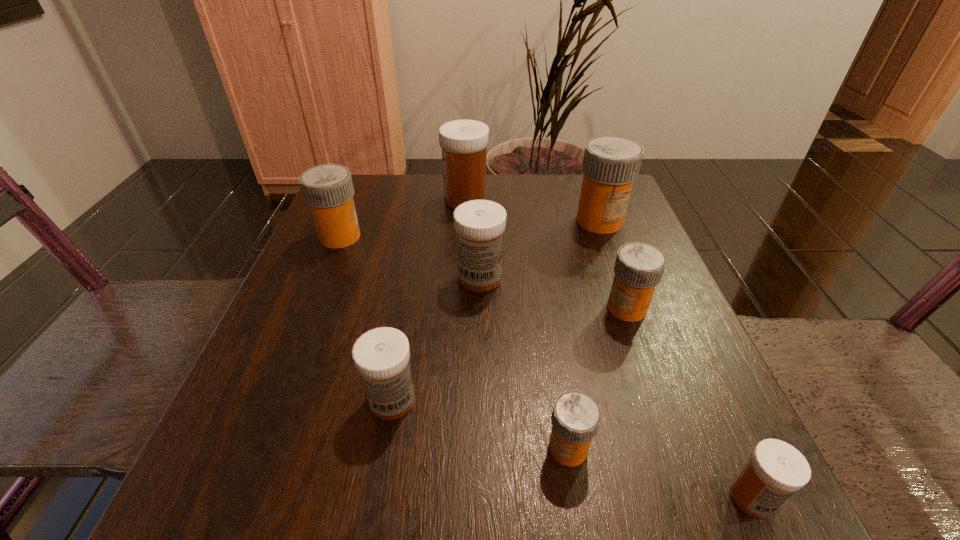
The height and width of the screenshot is (540, 960). What are the coordinates of `the nearest object` in the screenshot? It's located at (775, 470).

Locate an element on the screen. This screenshot has width=960, height=540. the smallest white medicine is located at coordinates click(x=775, y=470).

The height and width of the screenshot is (540, 960). I want to click on vacant space located 0.110m on the label side of the biggest orange medicine, so click(x=616, y=267).

I want to click on vacant point located 0.150m on the front of the biggest white medicine, so click(463, 250).

This screenshot has height=540, width=960. I want to click on vacant space located 0.320m on the label side of the leftmost object, so click(507, 237).

I want to click on vacant region located 0.280m on the left of the second biggest white medicine, so click(314, 278).

This screenshot has width=960, height=540. I want to click on vacant space located 0.100m on the label side of the second smallest orange medicine, so click(551, 308).

I want to click on vacant region located 0.080m on the label side of the second smallest orange medicine, so click(x=562, y=308).

Identify the location of free region located on the label side of the second smallest orange medicine. (557, 308).

Locate an element on the screen. This screenshot has width=960, height=540. vacant space located 0.080m on the left of the second medicine from left to right is located at coordinates (314, 400).